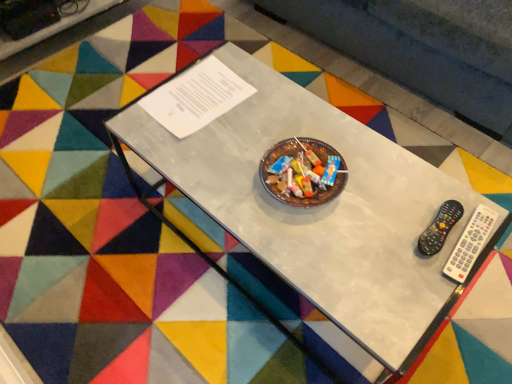
Identify the location of unoccupied area in front of black plastic remote at right. The width and height of the screenshot is (512, 384). (414, 291).